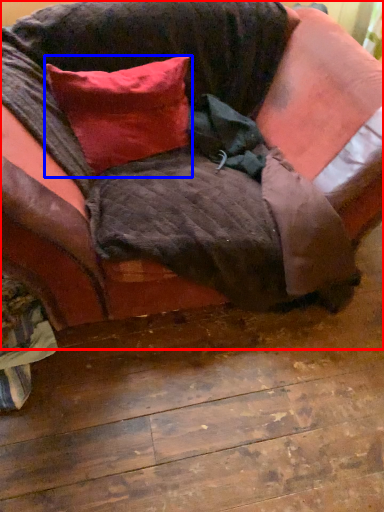
Question: Which object appears farthest to the camera in this image, studio couch (highlighted by a red box) or pillow (highlighted by a blue box)?

Choices:
 (A) studio couch
 (B) pillow

Answer: (B)